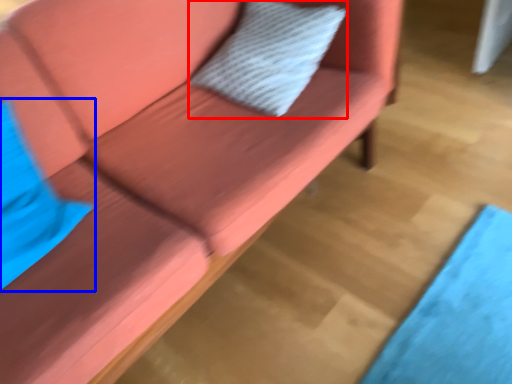
Question: Which object appears closest to the camera in this image, pillow (highlighted by a red box) or pillow (highlighted by a blue box)?

Choices:
 (A) pillow
 (B) pillow

Answer: (B)